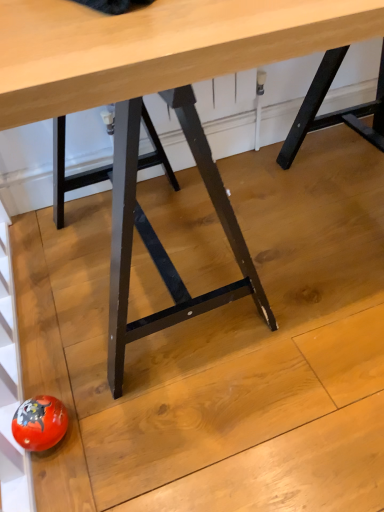
What are the coordinates of `free point in front of shiny red ball at lower left` in the screenshot? It's located at (54, 478).